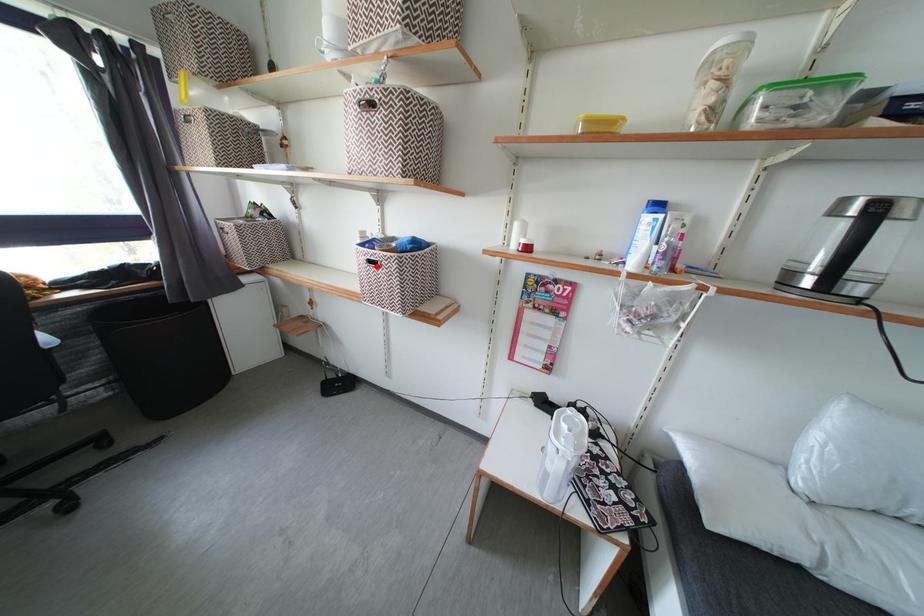
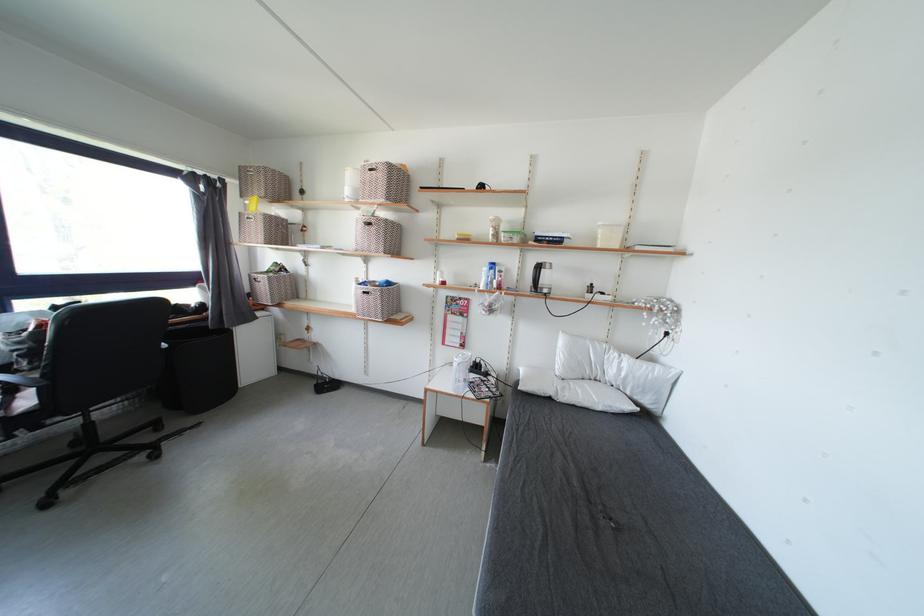
In the second image, find the point that corresponds to the highlighted location in the first image.

(371, 297)